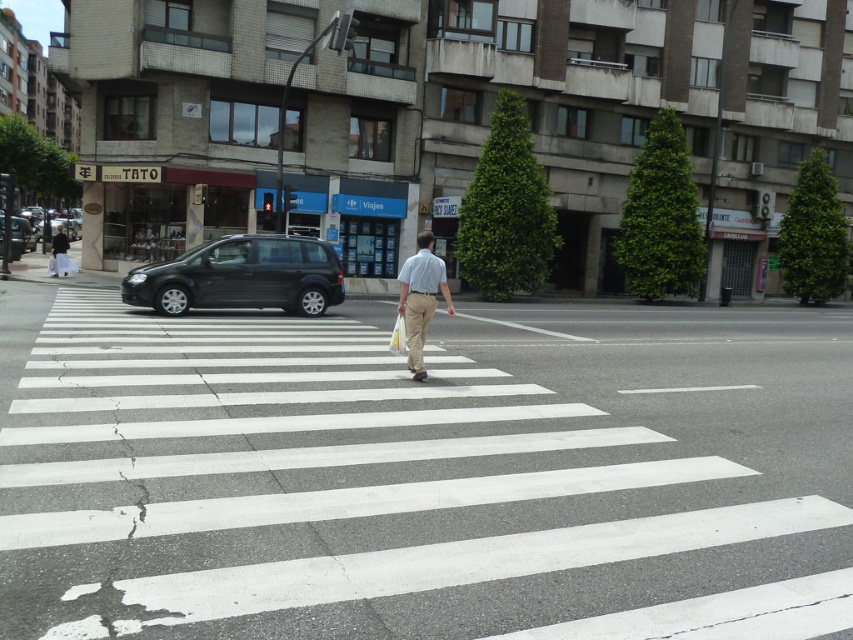
Is the position of black matte van at center less distant than that of matte black car at left?

Yes, black matte van at center is closer to the viewer.

Describe the element at coordinates (241, 276) in the screenshot. I see `black matte van at center` at that location.

Describe the element at coordinates (241, 276) in the screenshot. I see `black matte van at center` at that location.

You are a GUI agent. You are given a task and a screenshot of the screen. Output one action in this format:
    pyautogui.click(x=<x>, y=<y>)
    Task: Click on the black matte van at center
    The image size is (853, 640).
    Given the screenshot: What is the action you would take?
    pyautogui.click(x=241, y=276)

Is the position of white asphalt crosswalk at center less distant than that of light beige pants at left?

That is True.

Between white asphalt crosswalk at center and light beige pants at left, which one appears on the right side from the viewer's perspective?

From the viewer's perspective, white asphalt crosswalk at center appears more on the right side.

Where is `white asphalt crosswalk at center`? The height and width of the screenshot is (640, 853). white asphalt crosswalk at center is located at coordinates (422, 474).

Locate an element on the screen. white asphalt crosswalk at center is located at coordinates click(x=422, y=474).

Does white asphalt crosswalk at center have a greater height compared to khaki pants at center?

Incorrect, white asphalt crosswalk at center's height is not larger of khaki pants at center's.

Consider the image. Is white asphalt crosswalk at center bigger than khaki pants at center?

Yes.

Between point (416, 401) and point (407, 349), which one is positioned in front?

Point (416, 401) is in front.

Where is `white asphalt crosswalk at center`? This screenshot has width=853, height=640. white asphalt crosswalk at center is located at coordinates (422, 474).